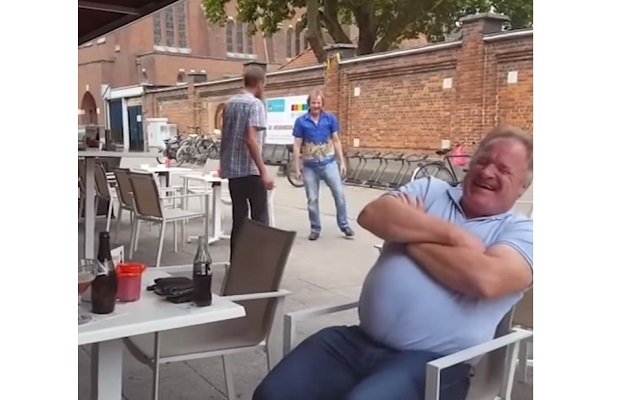
The image size is (620, 400). In order to click on chairs in this screenshot , I will do `click(253, 266)`, `click(149, 202)`, `click(123, 187)`, `click(104, 182)`.